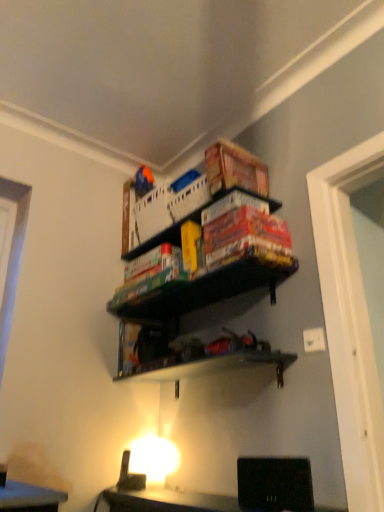
Question: From the image's perspective, is white plastic crate at upper center located above or below green matte board game at center?

Choices:
 (A) below
 (B) above

Answer: (B)

Question: In terms of height, does white plastic crate at upper center look taller or shorter compared to green matte board game at center?

Choices:
 (A) short
 (B) tall

Answer: (B)

Question: Does point coord(195,183) appear closer or farther from the camera than point coord(276,262)?

Choices:
 (A) closer
 (B) farther

Answer: (B)

Question: From the image's perspective, is green matte board game at center positioned above or below white plastic crate at upper center?

Choices:
 (A) above
 (B) below

Answer: (B)

Question: Relative to white plastic crate at upper center, is green matte board game at center in front or behind?

Choices:
 (A) front
 (B) behind

Answer: (A)

Question: Visually, is green matte board game at center positioned to the left or to the right of white plastic crate at upper center?

Choices:
 (A) left
 (B) right

Answer: (B)

Question: From a real-world perspective, is green matte board game at center above or below white plastic crate at upper center?

Choices:
 (A) below
 (B) above

Answer: (A)